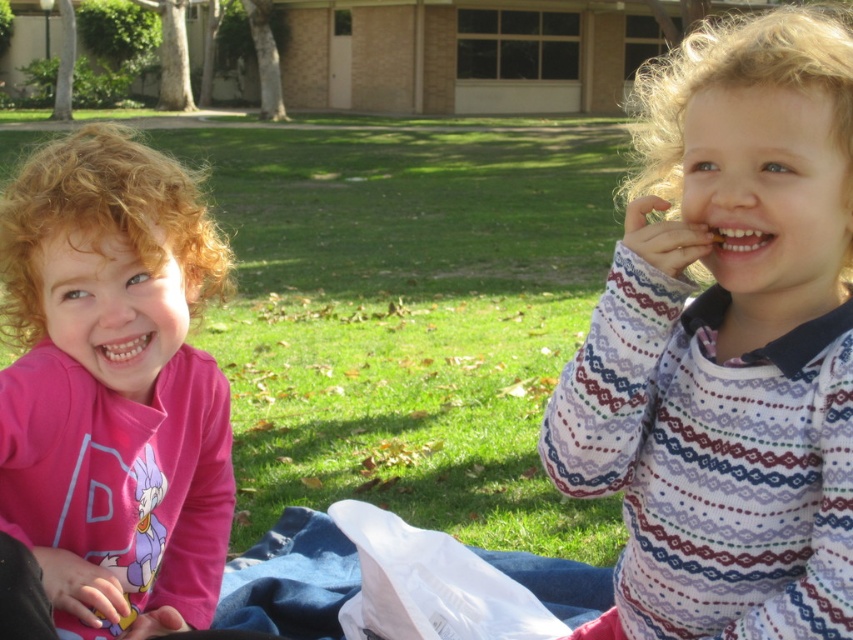
Question: Is white knit sweater at right thinner than pink matte shirt at left?

Choices:
 (A) no
 (B) yes

Answer: (B)

Question: Can you confirm if white knit sweater at right is positioned above pink matte shirt at left?

Choices:
 (A) no
 (B) yes

Answer: (B)

Question: Which point is closer to the camera?

Choices:
 (A) (140, 612)
 (B) (735, 212)

Answer: (B)

Question: Is white knit sweater at right bigger than pink matte shirt at left?

Choices:
 (A) yes
 (B) no

Answer: (B)